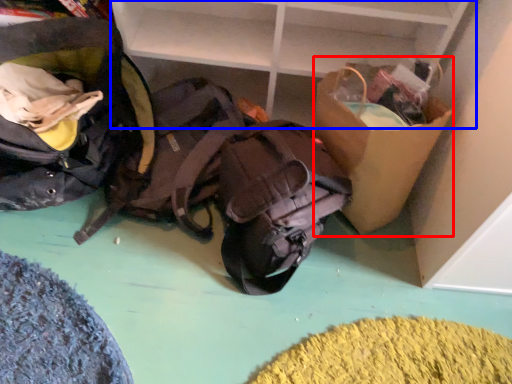
Question: Which point is closer to the camera, cardboard box (highlighted by a red box) or shelf (highlighted by a blue box)?

Choices:
 (A) cardboard box
 (B) shelf

Answer: (A)